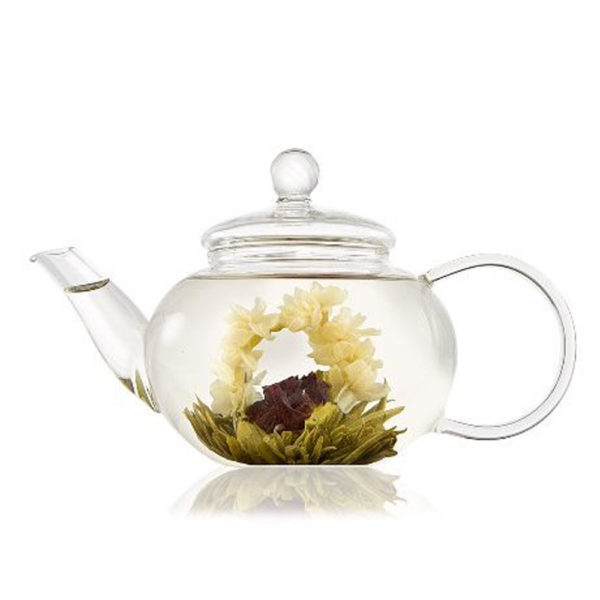
What are the coordinates of `1 handle` in the screenshot? It's located at (522, 258).